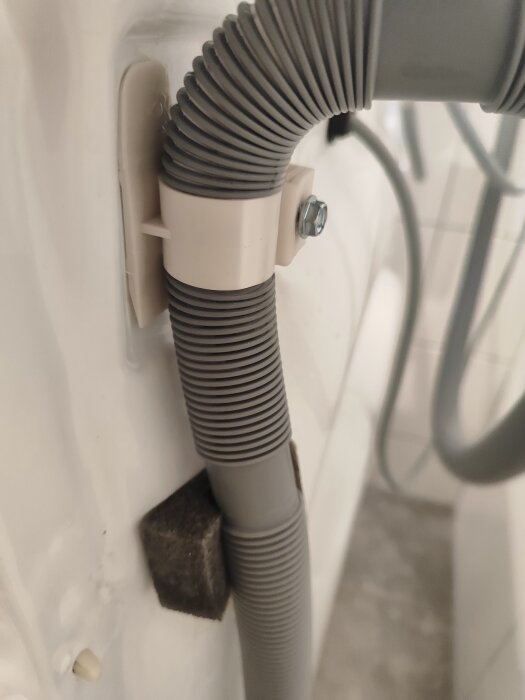
Where is `holder`? holder is located at coordinates (199, 540).